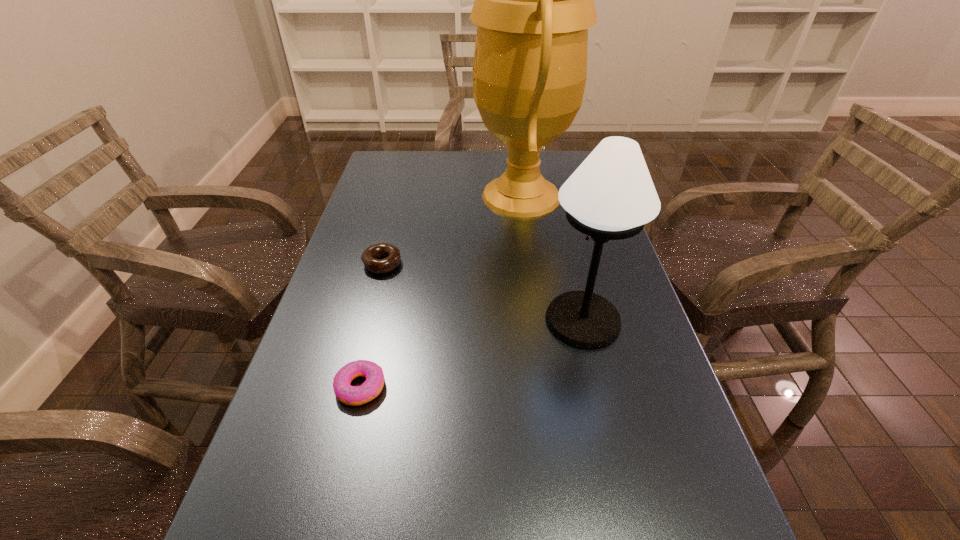
Find the location of a particular element. This screenshot has width=960, height=540. vacant space that satisfies the following two spatial constraints: 1. on the engravings side of the table lamp; 2. on the left side of the trophy is located at coordinates (539, 320).

Identify the location of blank space that satisfies the following two spatial constraints: 1. on the front side of the nearer doughnut; 2. on the left side of the farther doughnut. (349, 387).

Where is `free space that satisfies the following two spatial constraints: 1. on the back side of the second nearest object; 2. on the right side of the nearest object`? free space that satisfies the following two spatial constraints: 1. on the back side of the second nearest object; 2. on the right side of the nearest object is located at coordinates (376, 320).